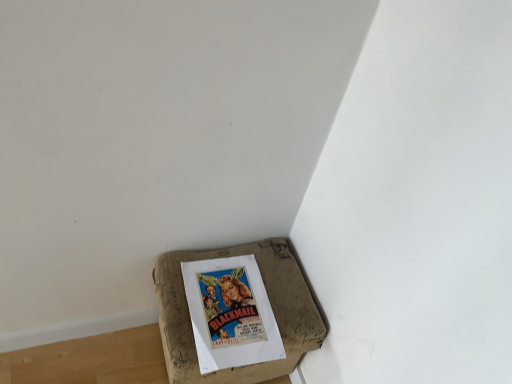
Question: Is point (229, 360) positioned closer to the camera than point (172, 354)?

Choices:
 (A) farther
 (B) closer

Answer: (B)

Question: In terms of width, does vintage paper poster at bottom corner look wider or thinner when compared to brown cardboard box at lower left?

Choices:
 (A) wide
 (B) thin

Answer: (B)

Question: Considering their positions, is vintage paper poster at bottom corner located in front of or behind brown cardboard box at lower left?

Choices:
 (A) front
 (B) behind

Answer: (B)

Question: Is brown cardboard box at lower left to the left or to the right of vintage paper poster at bottom corner in the image?

Choices:
 (A) right
 (B) left

Answer: (B)

Question: Looking at their shapes, would you say brown cardboard box at lower left is wider or thinner than vintage paper poster at bottom corner?

Choices:
 (A) thin
 (B) wide

Answer: (B)

Question: Considering the positions of brown cardboard box at lower left and vintage paper poster at bottom corner in the image, is brown cardboard box at lower left taller or shorter than vintage paper poster at bottom corner?

Choices:
 (A) tall
 (B) short

Answer: (A)

Question: From the image's perspective, is brown cardboard box at lower left positioned above or below vintage paper poster at bottom corner?

Choices:
 (A) below
 (B) above

Answer: (A)